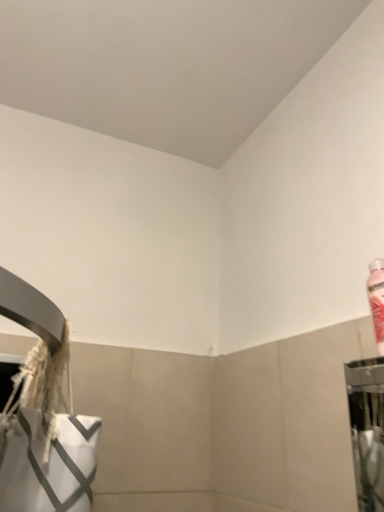
Question: Should I look upward or downward to see pink plastic bottle at upper right?

Choices:
 (A) down
 (B) up

Answer: (A)